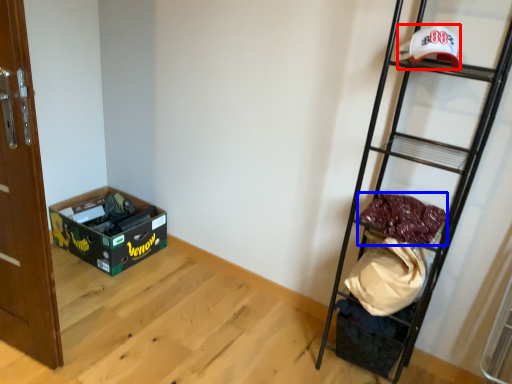
Question: Which object appears closest to the camera in this image, baseball hat (highlighted by a red box) or material (highlighted by a blue box)?

Choices:
 (A) baseball hat
 (B) material

Answer: (A)